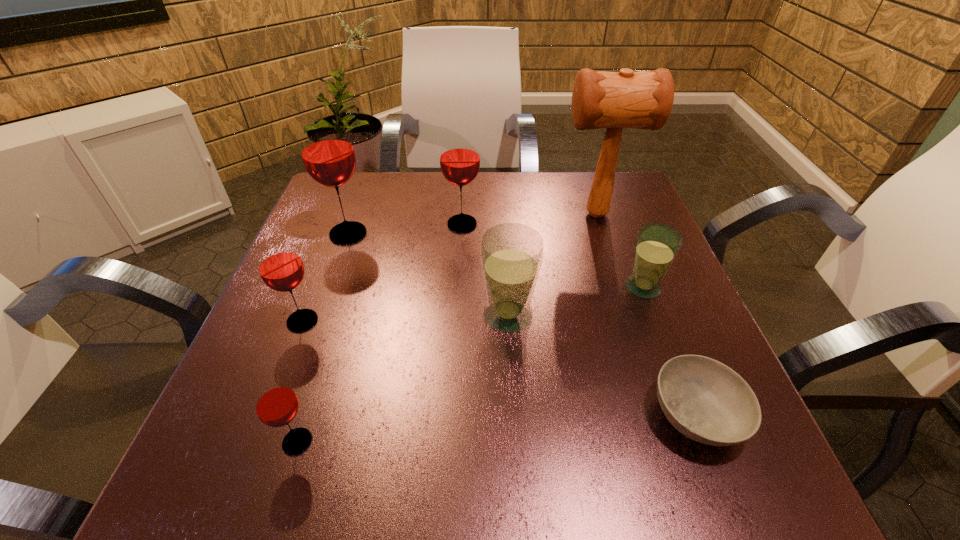
Find the location of a particular element. This screenshot has width=960, height=540. vacant region located on the right of the nearest red glass is located at coordinates (571, 441).

You are a GUI agent. You are given a task and a screenshot of the screen. Output one action in this format:
    pyautogui.click(x=<x>, y=<y>)
    Task: Click on the free space located 0.330m on the back of the shortest object
    The height and width of the screenshot is (540, 960).
    Given the screenshot: What is the action you would take?
    pyautogui.click(x=632, y=250)

This screenshot has height=540, width=960. I want to click on mallet that is at the far edge, so (626, 99).

This screenshot has height=540, width=960. Find the location of `glass situated at the near edge`. glass situated at the near edge is located at coordinates (276, 404).

Identify the location of bowl present at the near edge. The height and width of the screenshot is (540, 960). (705, 400).

In order to click on mallet that is at the right edge in this screenshot , I will do `click(626, 99)`.

The image size is (960, 540). Find the location of `glass located at the right edge`. glass located at the right edge is located at coordinates (657, 245).

Locate an element on the screen. This screenshot has width=960, height=540. bowl that is at the right edge is located at coordinates (705, 400).

Find the location of a particular element. The width and height of the screenshot is (960, 540). object that is at the far left corner is located at coordinates (327, 151).

The image size is (960, 540). What are the coordinates of `object that is at the near left corner` in the screenshot? It's located at (276, 404).